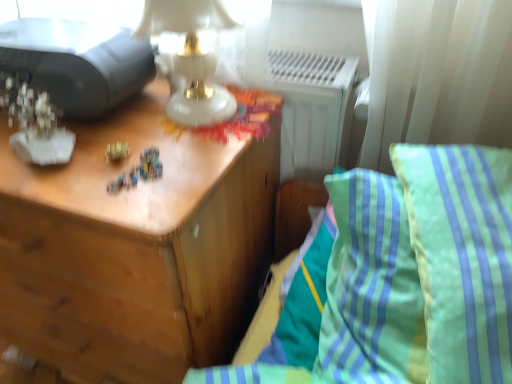
This screenshot has width=512, height=384. I want to click on unoccupied space behind gold metallic toy at center, so click(x=138, y=119).